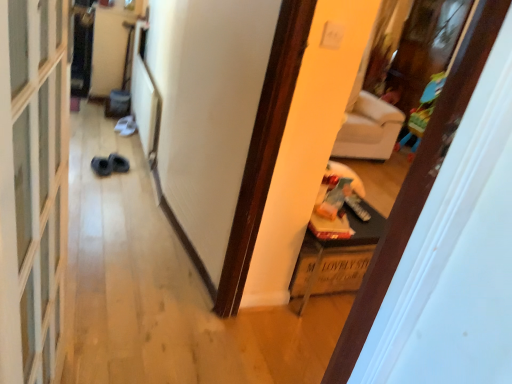
Question: Should I look upward or downward to see plastic colorful playpen at upper right?

Choices:
 (A) up
 (B) down

Answer: (A)

Question: Is white matte door at center behind transparent glass screen door at left?

Choices:
 (A) yes
 (B) no

Answer: (A)

Question: Considering the relative sizes of white matte door at center and transparent glass screen door at left in the image provided, is white matte door at center taller than transparent glass screen door at left?

Choices:
 (A) yes
 (B) no

Answer: (A)

Question: Are white matte door at center and transparent glass screen door at left making contact?

Choices:
 (A) no
 (B) yes

Answer: (A)

Question: Is transparent glass screen door at left a part of white matte door at center?

Choices:
 (A) no
 (B) yes

Answer: (A)

Question: From a real-world perspective, is white matte door at center located beneath transparent glass screen door at left?

Choices:
 (A) no
 (B) yes

Answer: (A)

Question: Is white matte door at center turned away from transparent glass screen door at left?

Choices:
 (A) yes
 (B) no

Answer: (A)

Question: From a real-world perspective, is white matte door at center positioned over wooden crate at lower right based on gravity?

Choices:
 (A) yes
 (B) no

Answer: (A)

Question: Is white matte door at center further to camera compared to wooden crate at lower right?

Choices:
 (A) yes
 (B) no

Answer: (B)

Question: Is white matte door at center looking in the opposite direction of wooden crate at lower right?

Choices:
 (A) yes
 (B) no

Answer: (B)

Question: Is white matte door at center aimed at wooden crate at lower right?

Choices:
 (A) no
 (B) yes

Answer: (A)

Question: From a real-world perspective, does white matte door at center sit lower than wooden crate at lower right?

Choices:
 (A) yes
 (B) no

Answer: (B)

Question: From the image's perspective, is white matte door at center under wooden crate at lower right?

Choices:
 (A) no
 (B) yes

Answer: (A)

Question: Does wooden crate at lower right have a greater width compared to plastic colorful playpen at upper right?

Choices:
 (A) no
 (B) yes

Answer: (B)